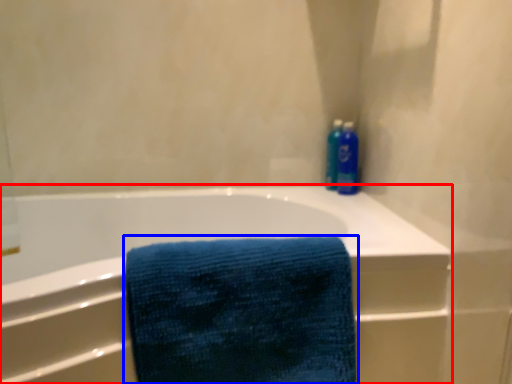
Question: Among these objects, which one is nearest to the camera, bathtub (highlighted by a red box) or towel (highlighted by a blue box)?

Choices:
 (A) bathtub
 (B) towel

Answer: (A)